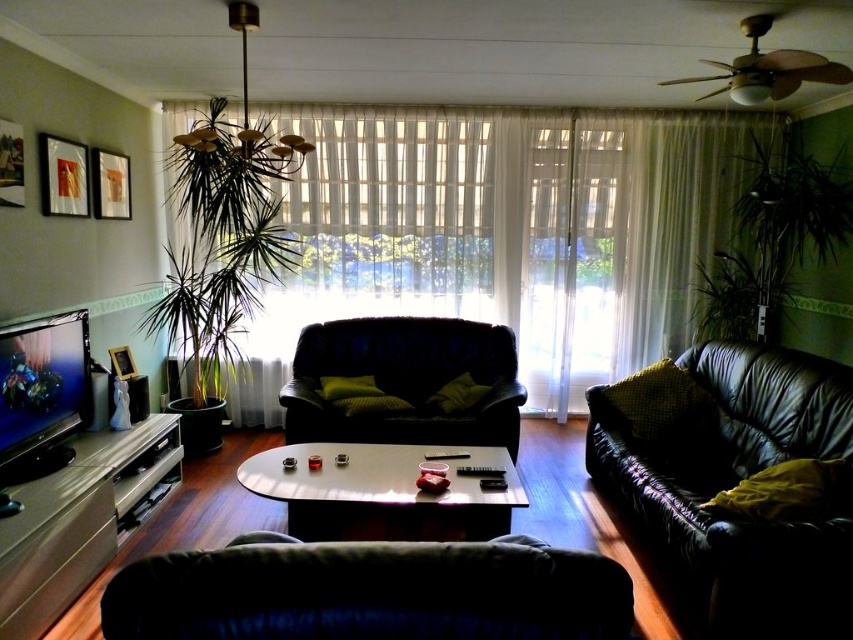
Looking at this image, you are standing in the living room and need to place a small plant on the coffee table. Given the coordinates of the black leather couch at right, can you determine if the coffee table is to the left or right of the couch?

The black leather couch at right is located at point (x=737, y=481). Since the coffee table is positioned in the foreground and the couch is at the right, the coffee table is likely to the left of the couch based on typical room layouts, but the exact spatial relationship requires knowing the coffee table coordinates which are not provided. However, according to the scene description, the coffee table is positioned in the foreground, which might mean it is centrally located between the couch and the TV, so it

You are planning to rearrange the living room and want to place a large potted plant between the dark green leather couch at lower center and the velvet green armchair at center. Considering their sizes, which piece of furniture should the plant be closer to?

The plant should be closer to the velvet green armchair at center because the dark green leather couch at lower center occupies less space than the velvet green armchair at center, meaning the armchair takes up more space and thus the plant should be placed nearer to balance the arrangement.

You are arranging a party in the living room and want to place a large centerpiece on the coffee table. The centerpiece requires a clear space between the black leather couch at right and the wooden picture frame at upper left. Is there enough space between them?

The black leather couch at right is positioned on the right side of wooden picture frame at upper left, so there is space between them for the centerpiece.